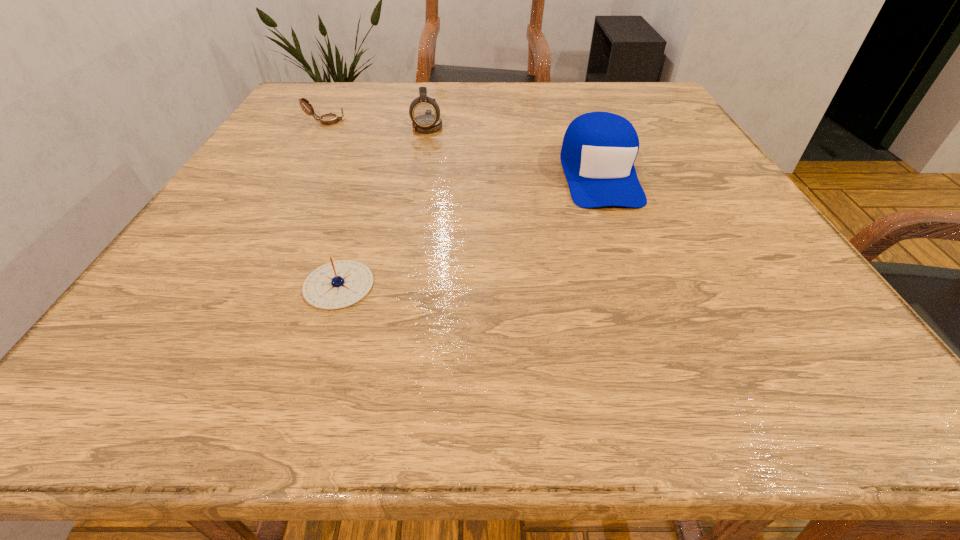
The width and height of the screenshot is (960, 540). In order to click on the third object from left to right in this screenshot , I will do `click(424, 111)`.

You are a GUI agent. You are given a task and a screenshot of the screen. Output one action in this format:
    pyautogui.click(x=<x>, y=<y>)
    Task: Click on the tallest compass
    The width and height of the screenshot is (960, 540).
    Given the screenshot: What is the action you would take?
    pyautogui.click(x=424, y=111)

Locate an element on the screen. the third farthest object is located at coordinates (599, 149).

Where is `baseball cap`? This screenshot has width=960, height=540. baseball cap is located at coordinates (599, 149).

The image size is (960, 540). I want to click on the leftmost compass, so click(327, 119).

Image resolution: width=960 pixels, height=540 pixels. I want to click on the nearest compass, so click(x=338, y=284).

You are a GUI agent. You are given a task and a screenshot of the screen. Output one action in this format:
    pyautogui.click(x=<x>, y=<y>)
    Task: Click on the nearest object
    This screenshot has width=960, height=540.
    Given the screenshot: What is the action you would take?
    pyautogui.click(x=338, y=284)

This screenshot has width=960, height=540. In order to click on free space located on the face of the second object from right to left in this screenshot , I will do click(414, 198).

This screenshot has width=960, height=540. Identify the location of vacant space positioned on the front-facing side of the baseball cap. [625, 247].

Locate an element on the screen. This screenshot has width=960, height=540. vacant space located 0.360m on the face of the leftmost object is located at coordinates (497, 122).